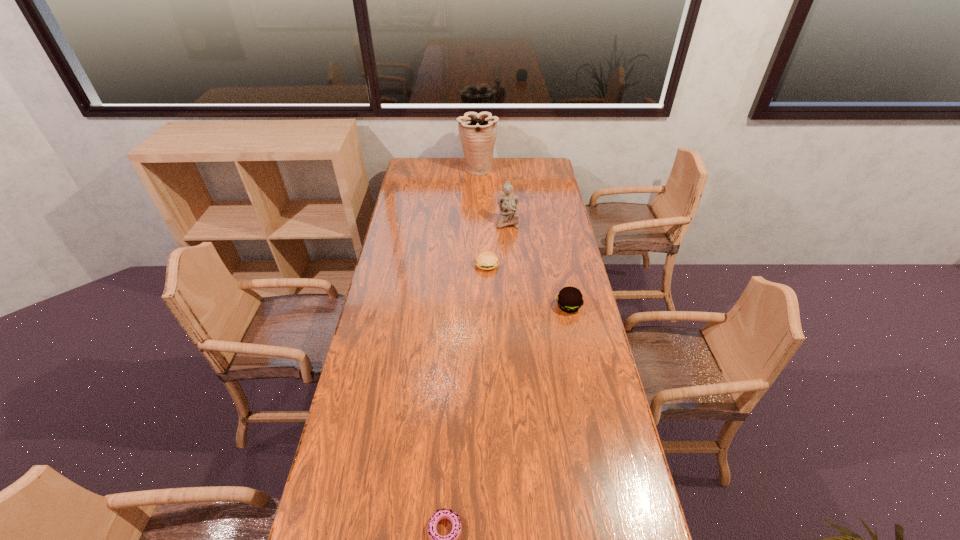
The width and height of the screenshot is (960, 540). I want to click on vacant region located 0.350m on the back of the rightmost object, so click(556, 244).

Locate an element on the screen. The image size is (960, 540). free space located on the front of the third farthest object is located at coordinates (488, 338).

What are the coordinates of `object present at the far edge` in the screenshot? It's located at (478, 132).

You are a GUI agent. You are given a task and a screenshot of the screen. Output one action in this format:
    pyautogui.click(x=<x>, y=<y>)
    Task: Click on the object situated at the right edge
    
    Given the screenshot: What is the action you would take?
    pyautogui.click(x=569, y=299)

Image resolution: width=960 pixels, height=540 pixels. Find the location of `vacant space at the far edge of the desktop`. vacant space at the far edge of the desktop is located at coordinates (450, 166).

This screenshot has width=960, height=540. In the image, there is a desktop. In order to click on vacant space at the left edge in this screenshot , I will do `click(394, 276)`.

You are a GUI agent. You are given a task and a screenshot of the screen. Output one action in this format:
    pyautogui.click(x=<x>, y=<y>)
    Task: Click on the vacant space at the right edge
    This screenshot has width=960, height=540.
    Given the screenshot: What is the action you would take?
    pyautogui.click(x=580, y=267)

Locate an element on the screen. vacant area between the tallest object and the third nearest object is located at coordinates (482, 217).

The image size is (960, 540). In order to click on free spot between the nearer patty and the farthest object in this screenshot , I will do `click(523, 238)`.

This screenshot has height=540, width=960. What are the coordinates of `vacant space that is in between the farthest object and the third farthest object` in the screenshot? It's located at (482, 217).